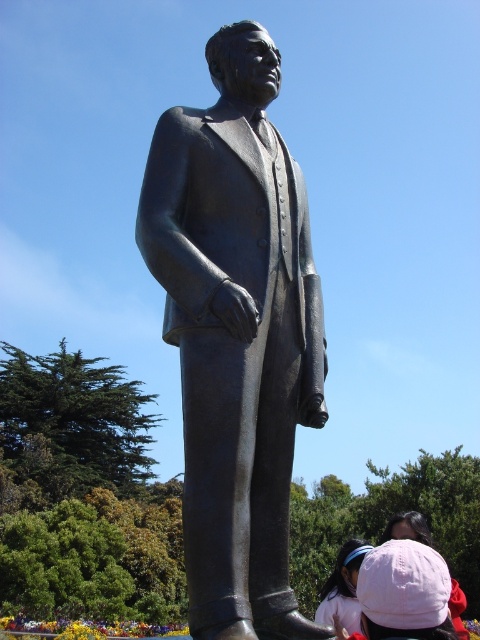
Which is above, bronze statue at center or pink fabric headband at lower right?

bronze statue at center is higher up.

Who is positioned more to the right, bronze statue at center or pink fabric headband at lower right?

Positioned to the right is pink fabric headband at lower right.

What do you see at coordinates (237, 333) in the screenshot? I see `bronze statue at center` at bounding box center [237, 333].

What are the coordinates of `bronze statue at center` in the screenshot? It's located at (237, 333).

Does pink fabric headband at lower right lie in front of pink fabric hat at lower right?

No, it is not.

Consider the image. Does pink fabric headband at lower right have a greater height compared to pink fabric hat at lower right?

Yes, pink fabric headband at lower right is taller than pink fabric hat at lower right.

Between point (346, 589) and point (454, 584), which one is positioned behind?

Positioned behind is point (454, 584).

You are a GUI agent. You are given a task and a screenshot of the screen. Output one action in this format:
    pyautogui.click(x=<x>, y=<y>)
    Task: Click on the pink fabric headband at lower right
    
    Given the screenshot: What is the action you would take?
    pyautogui.click(x=343, y=588)

Between bronze statue at center and pink fabric hat at lower right, which one is positioned higher?

bronze statue at center is above.

This screenshot has width=480, height=640. What are the coordinates of `bronze statue at center` in the screenshot? It's located at (237, 333).